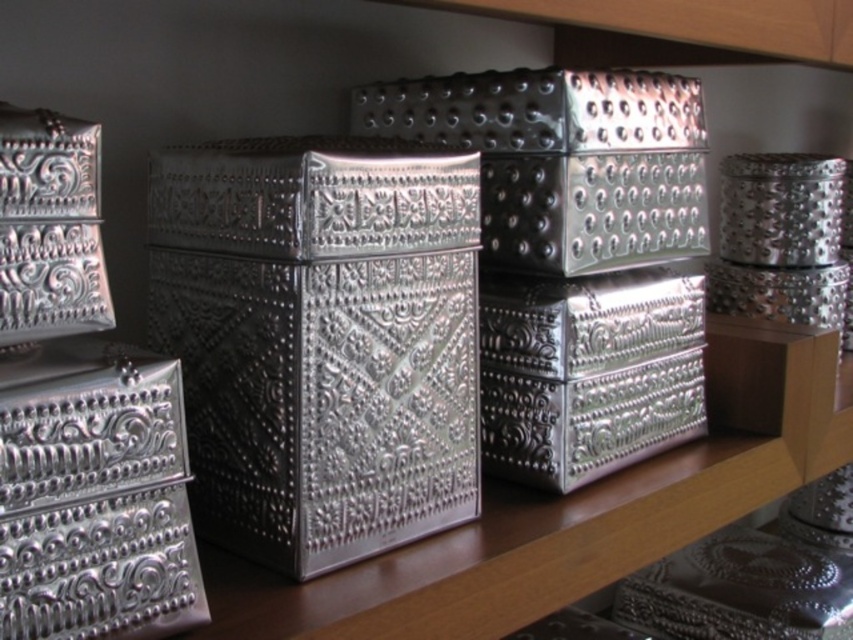
You are a delivery person who needs to place a new container that is 1.2 meters long between the silver textured box at left and the metallic textured box at center on the wooden shelf. Can you fit it between them without moving any other containers?

The silver textured box at left and metallic textured box at center are 1.06 meters apart from each other. Since the new container is 1.2 meters long, which is longer than the space between them, you cannot fit it between them without moving other containers.

You are organizing a display of silver textured boxes. You have two boxes to place on a shelf. The silver textured box at center and the silver textured box at left. Which box should you place closer to the front of the shelf to maintain the arrangement shown in the image?

You should place the silver textured box at center closer to the front of the shelf because it is closer to the viewer than the silver textured box at left in the image.

You are a delivery person who needs to place a new container that is 1 meter long between the silver textured box at center and the metallic textured box at center on the wooden shelf. Based on the current arrangement, can the new container fit between them?

The distance between the silver textured box at center and the metallic textured box at center is 93.85 centimeters. Since the new container is 1 meter long, which is longer than the available space, it cannot fit between them.